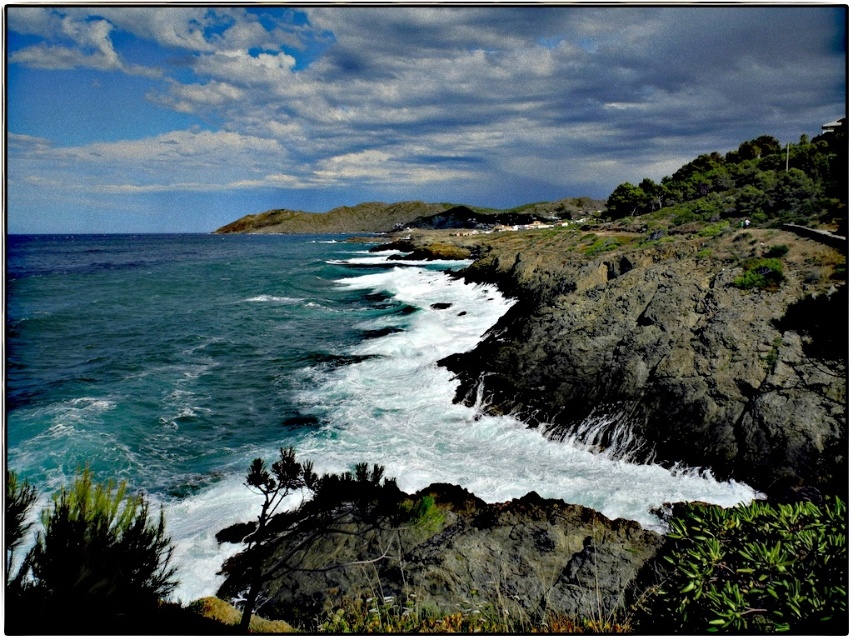
Question: Among these objects, which one is nearest to the camera?

Choices:
 (A) rocky cliff at center
 (B) dark gray rock at center
 (C) blue-green water at lower left

Answer: (A)

Question: Which of the following is the farthest from the observer?

Choices:
 (A) rocky cliff at center
 (B) dark gray rock at center

Answer: (B)

Question: Is blue-green water at lower left smaller than rocky cliff at center?

Choices:
 (A) no
 (B) yes

Answer: (A)

Question: Does rocky cliff at center appear on the left side of dark gray rock at center?

Choices:
 (A) no
 (B) yes

Answer: (A)

Question: Which of the following is the closest to the observer?

Choices:
 (A) rocky cliff at center
 (B) blue-green water at lower left
 (C) dark gray rock at center

Answer: (A)

Question: Is blue-green water at lower left behind rocky cliff at center?

Choices:
 (A) no
 (B) yes

Answer: (B)